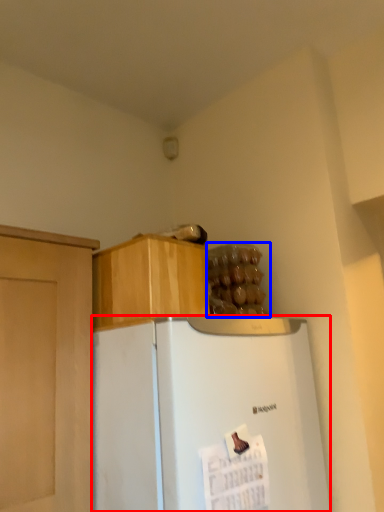
Question: Which point is further to the camera, refrigerator (highlighted by a red box) or food (highlighted by a blue box)?

Choices:
 (A) refrigerator
 (B) food

Answer: (B)